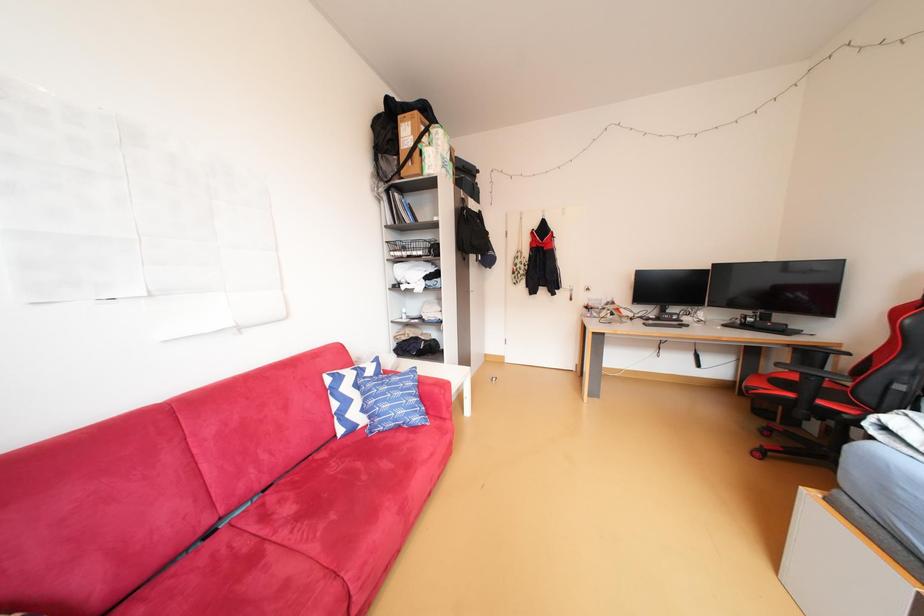
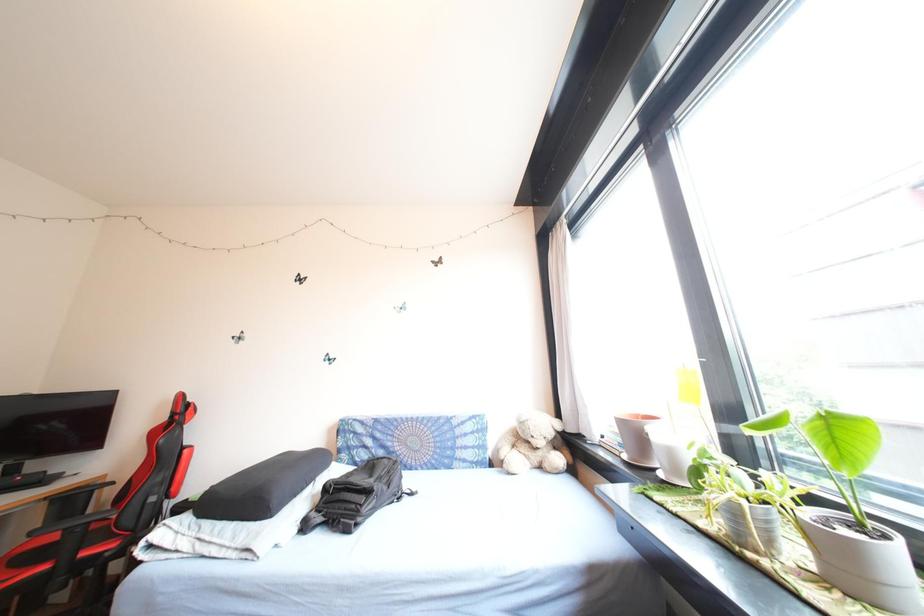
Question: How did the camera likely rotate?

Choices:
 (A) Left
 (B) Right
 (C) Up
 (D) Down

Answer: (B)